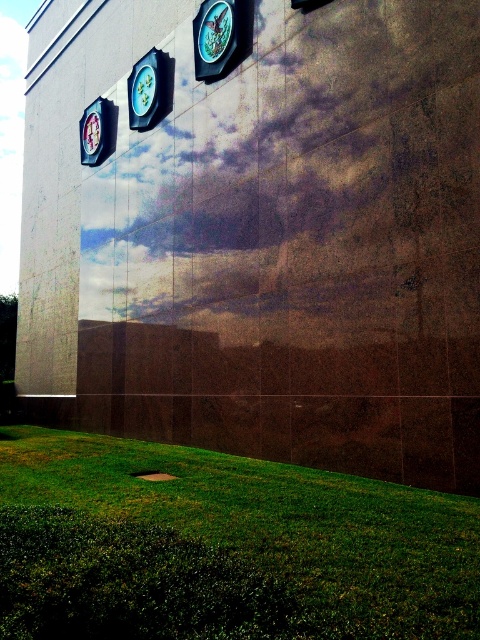
Question: Among these points, which one is nearest to the camera?

Choices:
 (A) (219, 56)
 (B) (425, 630)

Answer: (B)

Question: Does metallic silver clock at upper center come behind metallic blue clock at left?

Choices:
 (A) no
 (B) yes

Answer: (A)

Question: Is green grass at lower center above metallic blue clock at left?

Choices:
 (A) yes
 (B) no

Answer: (B)

Question: Which point is farther to the camera?

Choices:
 (A) metallic silver clock at upper center
 (B) metallic blue clock at left
 (C) green grass at lower center

Answer: (B)

Question: Where is green grass at lower center located in relation to metallic blue clock at left in the image?

Choices:
 (A) left
 (B) right

Answer: (B)

Question: Based on their relative distances, which object is nearer to the metallic silver clock at upper center?

Choices:
 (A) green grass at lower center
 (B) metallic blue clock at left

Answer: (B)